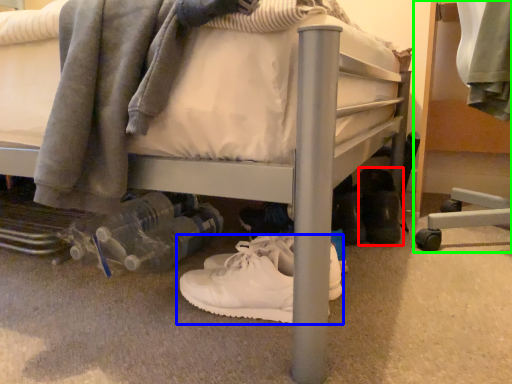
Question: Based on their relative distances, which object is nearer to footwear (highlighted by a red box)? Choose from footwear (highlighted by a blue box) and furniture (highlighted by a green box).

Choices:
 (A) footwear
 (B) furniture

Answer: (B)